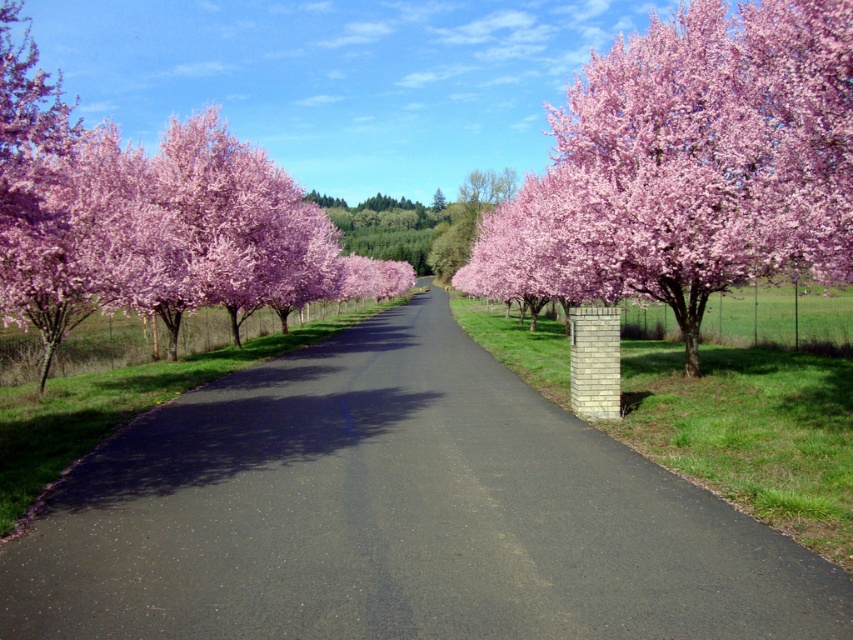
You are a gardener planning to plant a new tree along the black asphalt driveway at center. Considering the existing pink blossoming tree at left, which area has more space available for planting?

The pink blossoming tree at left occupies more space than the black asphalt driveway at center, so there is more space available at the black asphalt driveway at center for planting a new tree.

You are driving a car that is 2 meters wide. You see the black asphalt driveway at center and the pink bloom at center. Can your car fit through the space between them?

The black asphalt driveway at center is in front of the pink bloom at center, but the description does not provide information about the width of the space between them. Therefore, it is impossible to determine if the car can fit through the space based on the given information.